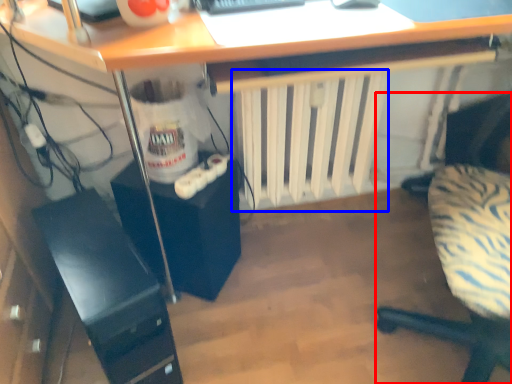
Question: Among these objects, which one is farthest to the camera, chair (highlighted by a red box) or radiator (highlighted by a blue box)?

Choices:
 (A) chair
 (B) radiator

Answer: (B)